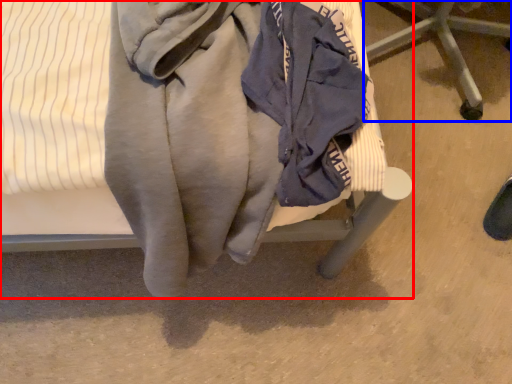
Question: Which point is further to the camera, furniture (highlighted by a red box) or furniture (highlighted by a blue box)?

Choices:
 (A) furniture
 (B) furniture

Answer: (B)